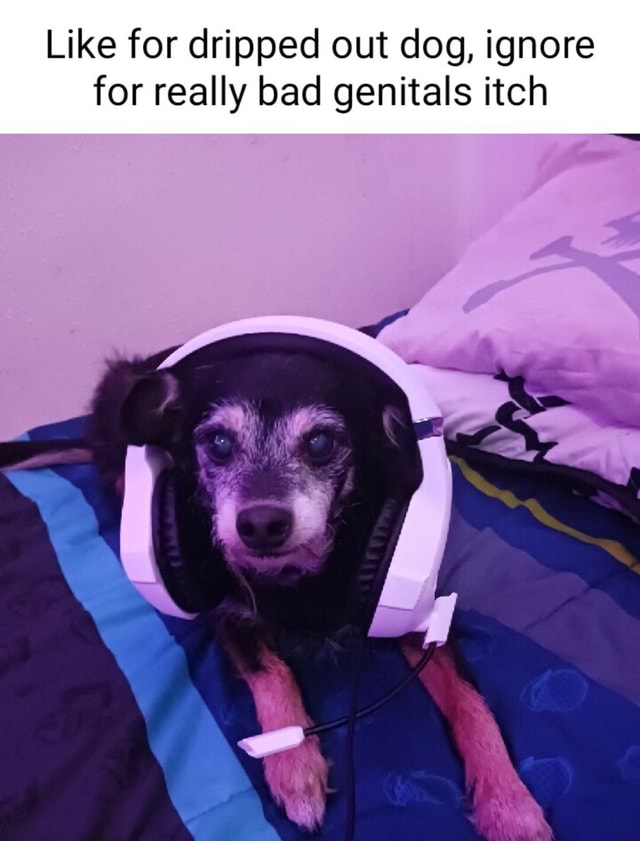
In order to click on bedspread in this screenshot , I will do `click(504, 637)`.